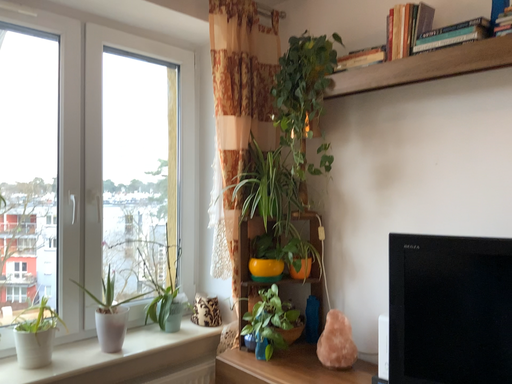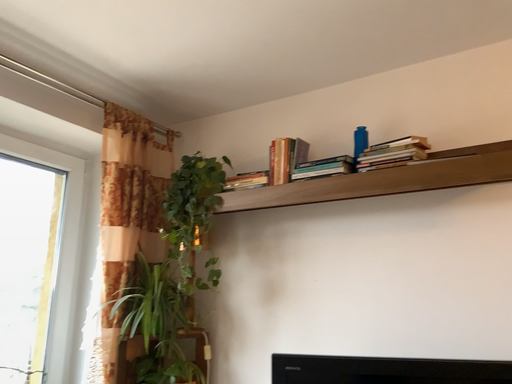
Question: How did the camera likely rotate when shooting the video?

Choices:
 (A) rotated left
 (B) rotated right

Answer: (B)